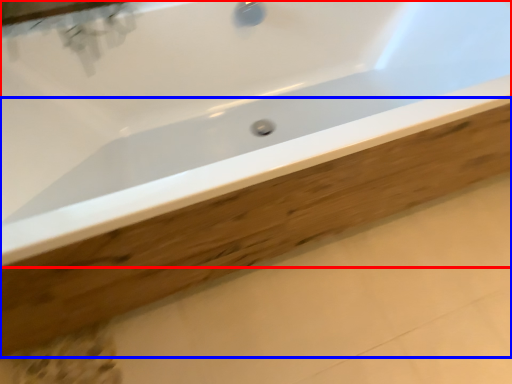
Question: Which object appears closest to the camera in this image, bathtub (highlighted by a red box) or plank (highlighted by a blue box)?

Choices:
 (A) bathtub
 (B) plank

Answer: (A)